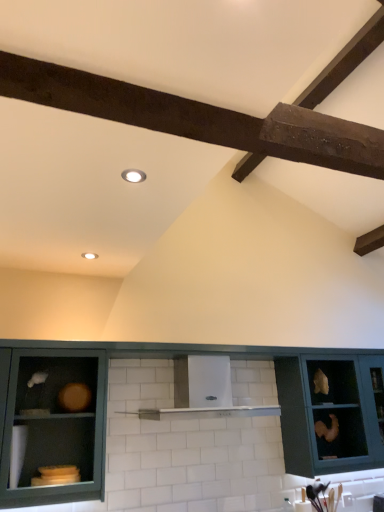
Question: Could you tell me if white glossy vent at center is facing matte teal cabinet at center, the 2th cabinetry in the left-to-right sequence?

Choices:
 (A) no
 (B) yes

Answer: (A)

Question: From a real-world perspective, is white glossy vent at center physically above matte teal cabinet at center, the 2th cabinetry in the left-to-right sequence?

Choices:
 (A) yes
 (B) no

Answer: (A)

Question: Can you confirm if white glossy vent at center is shorter than matte teal cabinet at center, placed as the 2th cabinetry when sorted from right to left?

Choices:
 (A) no
 (B) yes

Answer: (B)

Question: Can you confirm if white glossy vent at center is bigger than matte teal cabinet at center, the 2th cabinetry in the left-to-right sequence?

Choices:
 (A) no
 (B) yes

Answer: (A)

Question: Considering the relative positions of white glossy vent at center and matte teal cabinet at center, placed as the 2th cabinetry when sorted from right to left, in the image provided, is white glossy vent at center to the left of matte teal cabinet at center, placed as the 2th cabinetry when sorted from right to left, from the viewer's perspective?

Choices:
 (A) yes
 (B) no

Answer: (A)

Question: From the image's perspective, is white glossy vent at center located beneath matte teal cabinet at center, the 2th cabinetry in the left-to-right sequence?

Choices:
 (A) yes
 (B) no

Answer: (B)

Question: Is matte teal cabinet at right, the third cabinetry in the left-to-right sequence, oriented away from matte green cabinet at lower left, positioned as the third cabinetry in right-to-left order?

Choices:
 (A) no
 (B) yes

Answer: (A)

Question: Is matte teal cabinet at right, which ranks as the 1th cabinetry in right-to-left order, not near matte green cabinet at lower left, acting as the 1th cabinetry starting from the left?

Choices:
 (A) yes
 (B) no

Answer: (A)

Question: Does matte teal cabinet at right, which ranks as the 1th cabinetry in right-to-left order, have a lesser width compared to matte green cabinet at lower left, positioned as the third cabinetry in right-to-left order?

Choices:
 (A) no
 (B) yes

Answer: (A)

Question: Considering the relative positions of matte teal cabinet at right, the third cabinetry in the left-to-right sequence, and matte green cabinet at lower left, positioned as the third cabinetry in right-to-left order, in the image provided, is matte teal cabinet at right, the third cabinetry in the left-to-right sequence, in front of matte green cabinet at lower left, positioned as the third cabinetry in right-to-left order,?

Choices:
 (A) yes
 (B) no

Answer: (B)

Question: From a real-world perspective, is matte teal cabinet at right, which ranks as the 1th cabinetry in right-to-left order, under matte green cabinet at lower left, acting as the 1th cabinetry starting from the left?

Choices:
 (A) yes
 (B) no

Answer: (B)

Question: Can we say matte teal cabinet at right, the third cabinetry in the left-to-right sequence, lies outside matte green cabinet at lower left, positioned as the third cabinetry in right-to-left order?

Choices:
 (A) no
 (B) yes

Answer: (B)

Question: Is matte teal cabinet at center, placed as the 2th cabinetry when sorted from right to left, placed right next to matte green cabinet at lower left, acting as the 1th cabinetry starting from the left?

Choices:
 (A) yes
 (B) no

Answer: (B)